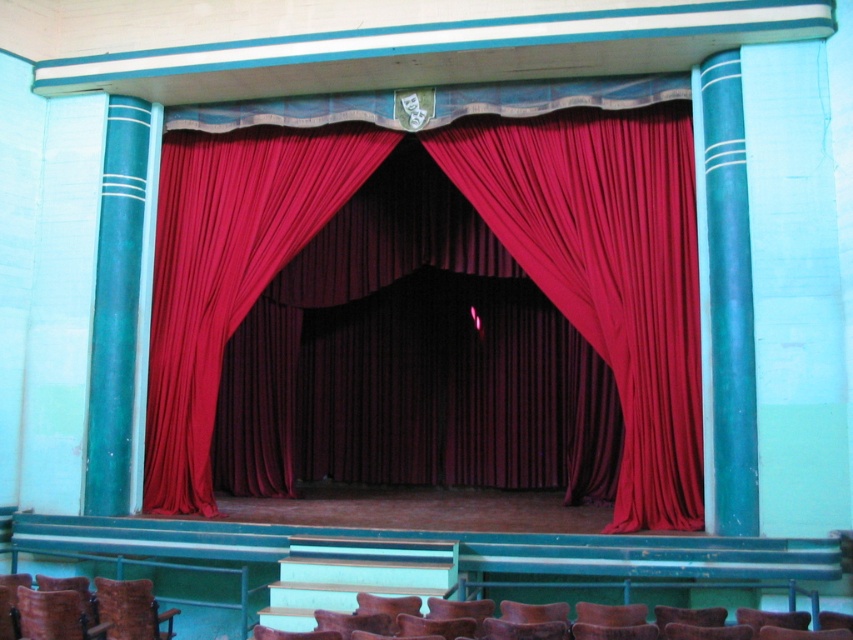
Question: Which of the following is the farthest from the observer?

Choices:
 (A) (141, 589)
 (B) (605, 202)

Answer: (B)

Question: Is velvet red curtain at center further to camera compared to velvet brown chair at lower left?

Choices:
 (A) yes
 (B) no

Answer: (A)

Question: Is velvet red curtain at center smaller than velvet brown chair at lower left?

Choices:
 (A) no
 (B) yes

Answer: (A)

Question: Does velvet red curtain at center have a larger size compared to velvet brown chair at lower left?

Choices:
 (A) no
 (B) yes

Answer: (B)

Question: Which point is closer to the camera taking this photo?

Choices:
 (A) (666, 458)
 (B) (99, 602)

Answer: (B)